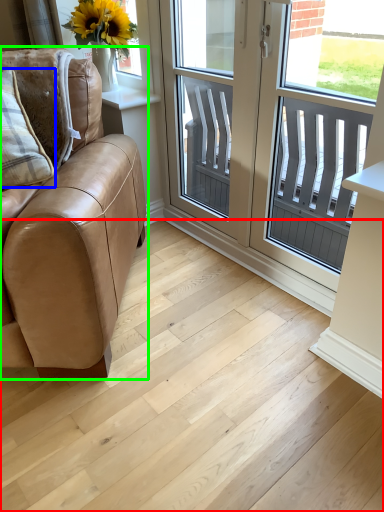
Question: Considering the real-world distances, which object is closest to stairwell (highlighted by a red box)? pillow (highlighted by a blue box) or studio couch (highlighted by a green box).

Choices:
 (A) pillow
 (B) studio couch

Answer: (B)